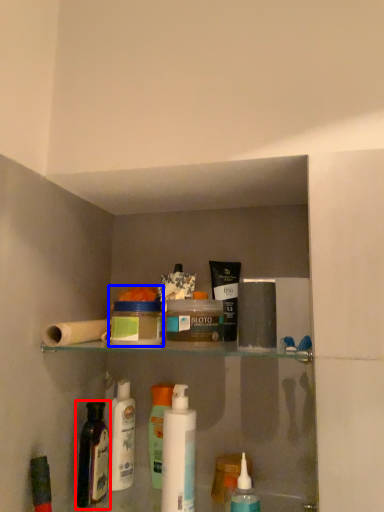
Question: Which point is closer to the camera, bottle (highlighted by a red box) or mouthwash (highlighted by a blue box)?

Choices:
 (A) bottle
 (B) mouthwash

Answer: (B)